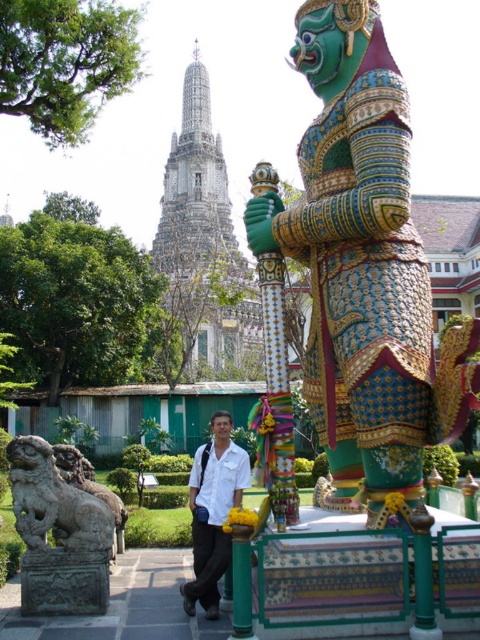
Question: Does green textured armor at center have a larger size compared to white matte shirt at center?

Choices:
 (A) no
 (B) yes

Answer: (A)

Question: Which object is positioned closest to the gray stone lion at lower left?

Choices:
 (A) white matte shirt at center
 (B) white stone temple at upper center
 (C) green textured armor at center

Answer: (A)

Question: Can you confirm if green textured armor at center is positioned below white matte shirt at center?

Choices:
 (A) no
 (B) yes

Answer: (A)

Question: Which object is the farthest from the green textured armor at center?

Choices:
 (A) white stone temple at upper center
 (B) white matte shirt at center

Answer: (A)

Question: Which is nearer to the white matte shirt at center?

Choices:
 (A) green textured armor at center
 (B) white stone temple at upper center
 (C) gray stone lion at lower left

Answer: (C)

Question: Does green textured armor at center appear under gray stone lion at lower left?

Choices:
 (A) yes
 (B) no

Answer: (B)